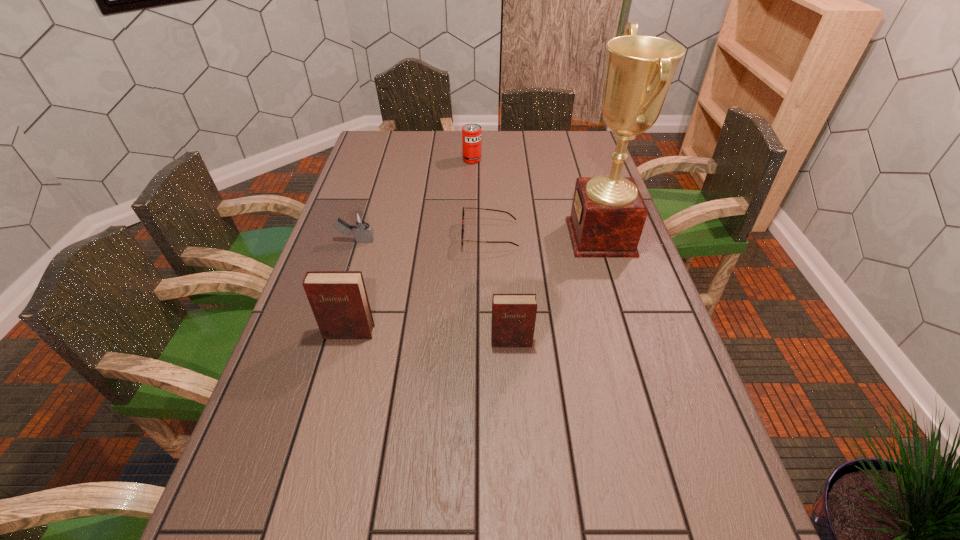
The width and height of the screenshot is (960, 540). Identify the location of igniter that is at the left edge. (363, 233).

This screenshot has width=960, height=540. In order to click on object located at the right edge in this screenshot , I will do `click(608, 213)`.

Image resolution: width=960 pixels, height=540 pixels. What are the coordinates of `free space at the far edge` in the screenshot? It's located at tap(444, 139).

The image size is (960, 540). In the image, there is a desktop. Identify the location of vacant space at the near edge. click(434, 455).

You are a GUI agent. You are given a task and a screenshot of the screen. Output one action in this format:
    pyautogui.click(x=<x>, y=<y>)
    Task: Click on the free region at the left edge
    The height and width of the screenshot is (540, 960).
    Given the screenshot: What is the action you would take?
    pyautogui.click(x=345, y=198)

Where is `free space at the right edge`? This screenshot has height=540, width=960. free space at the right edge is located at coordinates (610, 313).

What are the coordinates of `free space at the far left corner of the desktop` in the screenshot? It's located at (399, 144).

Image resolution: width=960 pixels, height=540 pixels. In the image, there is a desktop. Find the location of `vacant space at the far right corner`. vacant space at the far right corner is located at coordinates (588, 145).

The height and width of the screenshot is (540, 960). Find the location of `free space at the near right corner`. free space at the near right corner is located at coordinates (716, 502).

The width and height of the screenshot is (960, 540). What are the coordinates of `free space between the tallest object and the right diary` in the screenshot? It's located at (556, 289).